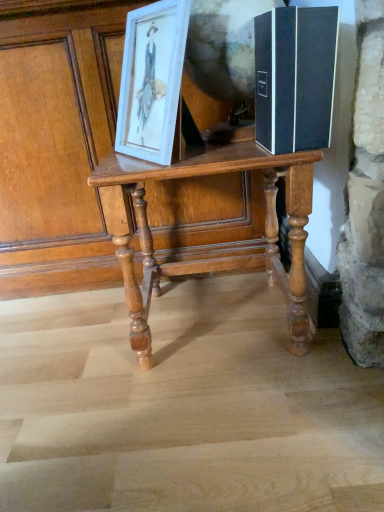
What do you see at coordinates (152, 80) in the screenshot? The image size is (384, 512). I see `white wood picture frame at upper left` at bounding box center [152, 80].

The height and width of the screenshot is (512, 384). Identify the location of wooden table at center. (212, 257).

What are the coordinates of `white wood picture frame at upper left` in the screenshot? It's located at (152, 80).

Which of these two, wooden table at center or white wood picture frame at upper left, stands taller?

With more height is wooden table at center.

Is wooden table at center aimed at white wood picture frame at upper left?

No, wooden table at center is not turned towards white wood picture frame at upper left.

How different are the orientations of wooden table at center and white wood picture frame at upper left in degrees?

There is a 29.9-degree angle between the facing directions of wooden table at center and white wood picture frame at upper left.

Is point (300, 199) in front of point (143, 57)?

Yes.

From the image's perspective, which is above, white wood picture frame at upper left or black matte book at right?

white wood picture frame at upper left, from the image's perspective.

Based on the photo, does white wood picture frame at upper left turn towards black matte book at right?

No, white wood picture frame at upper left is not oriented towards black matte book at right.

Between point (148, 6) and point (277, 57), which one is positioned in front?

Positioned in front is point (277, 57).

Would you say white wood picture frame at upper left is outside black matte book at right?

Yes, white wood picture frame at upper left is located beyond the bounds of black matte book at right.

Where is `picture frame on the left of black matte book at right`? This screenshot has width=384, height=512. picture frame on the left of black matte book at right is located at coordinates (152, 80).

Is black matte book at right bigger than white wood picture frame at upper left?

No.

Is point (294, 65) farther from camera compared to point (129, 31)?

No, it is in front of (129, 31).

Is black matte book at right aimed at white wood picture frame at upper left?

Yes, black matte book at right faces towards white wood picture frame at upper left.

Does wooden table at center contain black matte book at right?

No, black matte book at right is not a part of wooden table at center.

Can you tell me how much wooden table at center and black matte book at right differ in facing direction?

The facing directions of wooden table at center and black matte book at right are 1.88 degrees apart.

Which point is more distant from viewer, (171, 172) or (327, 14)?

The point (171, 172) is farther from the camera.

Can you confirm if wooden table at center is wider than black matte book at right?

Correct, the width of wooden table at center exceeds that of black matte book at right.

How many degrees apart are the facing directions of black matte book at right and wooden table at center?

There is a 1.88-degree angle between the facing directions of black matte book at right and wooden table at center.

Does black matte book at right have a larger size compared to wooden table at center?

No, black matte book at right is not bigger than wooden table at center.

Is black matte book at right thinner than wooden table at center?

Yes.

From a real-world perspective, is black matte book at right above or below wooden table at center?

From a real-world perspective, black matte book at right is physically above wooden table at center.

Is white wood picture frame at upper left oriented towards wooden table at center?

No, white wood picture frame at upper left does not turn towards wooden table at center.

Looking at this image, how many degrees apart are the facing directions of white wood picture frame at upper left and wooden table at center?

The angular difference between white wood picture frame at upper left and wooden table at center is 29.9 degrees.

Considering the sizes of objects white wood picture frame at upper left and wooden table at center in the image provided, who is wider, white wood picture frame at upper left or wooden table at center?

wooden table at center.

Is white wood picture frame at upper left not near wooden table at center?

Actually, white wood picture frame at upper left and wooden table at center are a little close together.

This screenshot has height=512, width=384. Identify the location of table located behind the white wood picture frame at upper left. (212, 257).

The image size is (384, 512). I want to click on picture frame that is on the left side of black matte book at right, so click(152, 80).

Considering their positions, is black matte book at right positioned further to wooden table at center than white wood picture frame at upper left?

The object further to wooden table at center is black matte book at right.

Considering their positions, is wooden table at center positioned closer to white wood picture frame at upper left than black matte book at right?

Among the two, black matte book at right is located nearer to white wood picture frame at upper left.

Based on their spatial positions, is white wood picture frame at upper left or black matte book at right closer to wooden table at center?

white wood picture frame at upper left is closer to wooden table at center.

When comparing their distances from white wood picture frame at upper left, does black matte book at right or wooden table at center seem closer?

black matte book at right is closer to white wood picture frame at upper left.

Estimate the real-world distances between objects in this image. Which object is closer to black matte book at right, wooden table at center or white wood picture frame at upper left?

white wood picture frame at upper left lies closer to black matte book at right than the other object.

When comparing their distances from black matte book at right, does white wood picture frame at upper left or wooden table at center seem closer?

white wood picture frame at upper left is closer to black matte book at right.

Locate an element on the screen. The height and width of the screenshot is (512, 384). book between white wood picture frame at upper left and wooden table at center in the up-down direction is located at coordinates (295, 78).